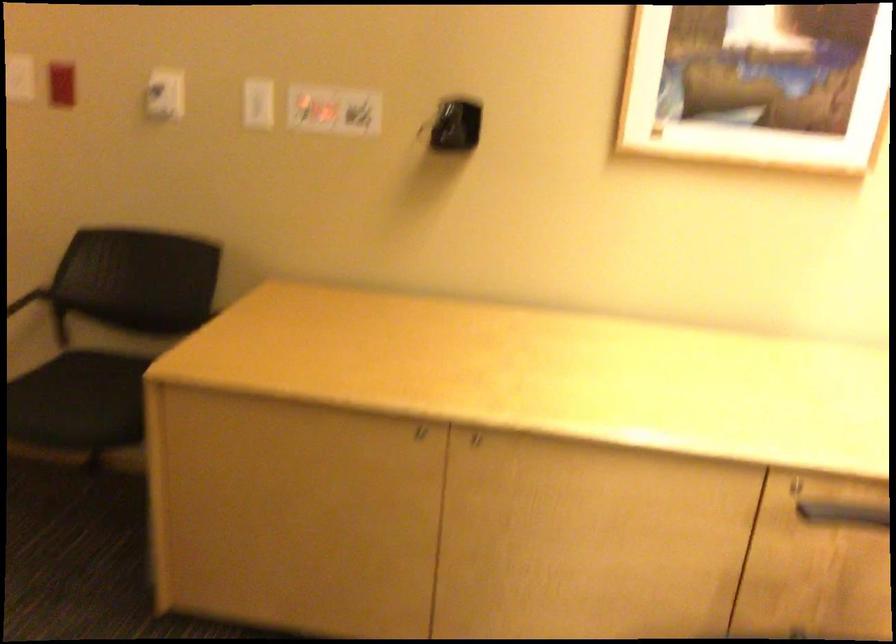
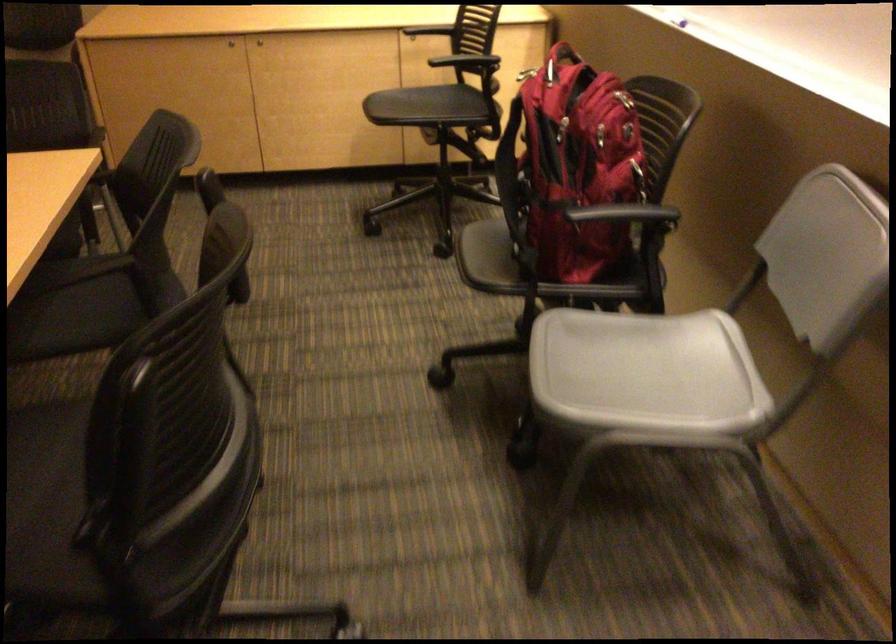
Where in the second image is the point corresponding to (x=496, y=460) from the first image?

(259, 41)